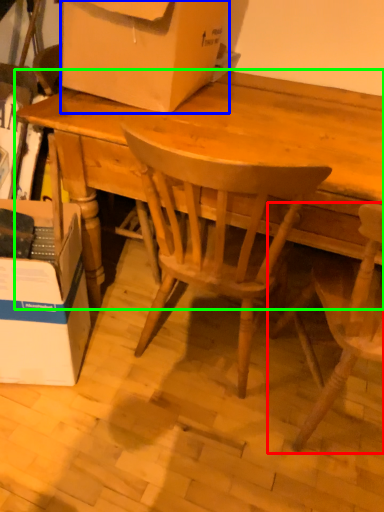
Question: Considering the real-world distances, which object is farthest from chair (highlighted by a red box)? box (highlighted by a blue box) or desk (highlighted by a green box)?

Choices:
 (A) box
 (B) desk

Answer: (A)